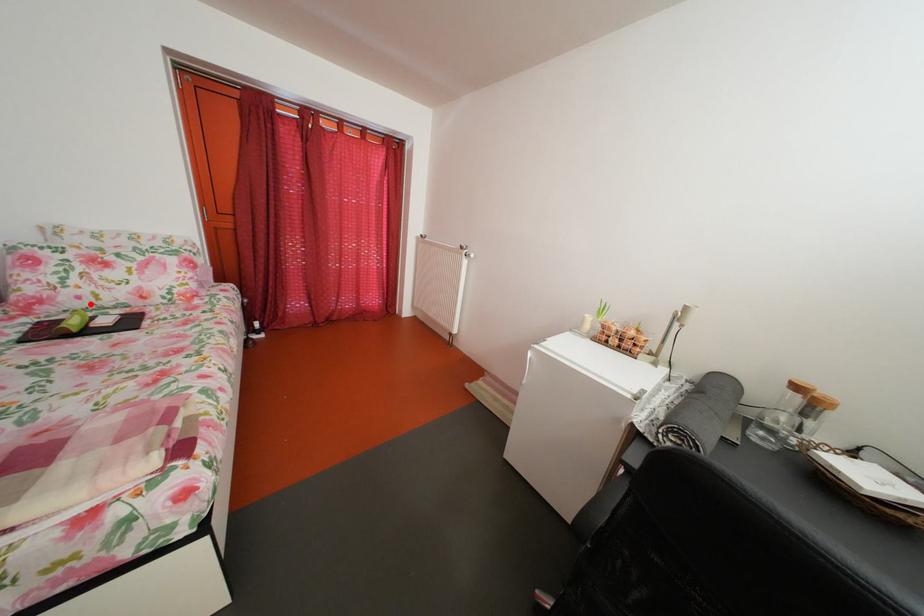
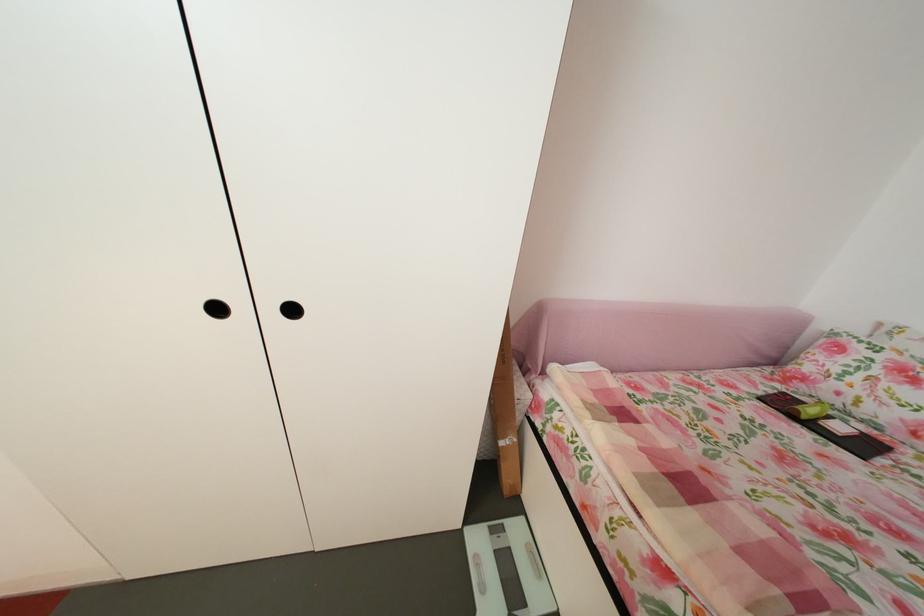
Locate, in the second image, the point that corresponds to the highlighted location in the first image.

(849, 400)